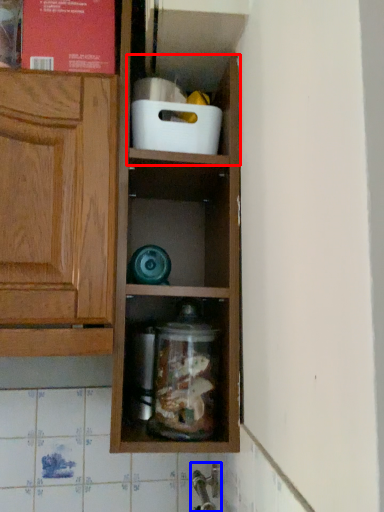
Question: Which of the following is the farthest to the observer, cabinet (highlighted by a red box) or faucet (highlighted by a blue box)?

Choices:
 (A) cabinet
 (B) faucet

Answer: (A)